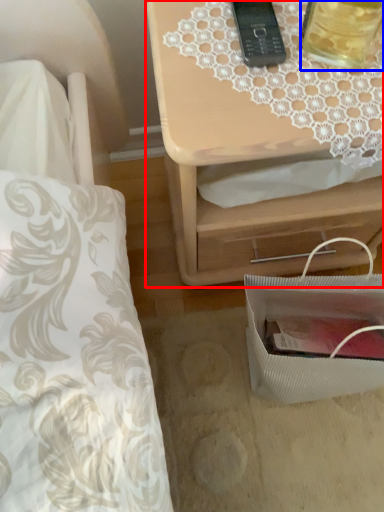
Question: Which point is closer to the camera, nightstand (highlighted by a red box) or beverage (highlighted by a blue box)?

Choices:
 (A) nightstand
 (B) beverage

Answer: (B)